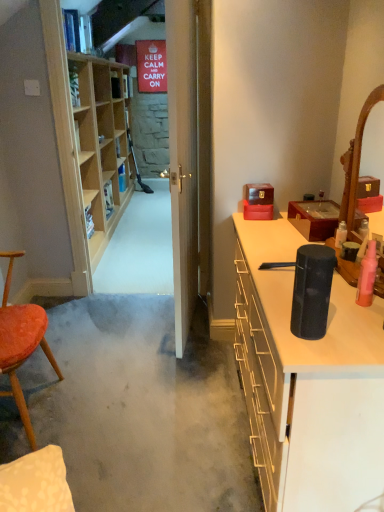
The image size is (384, 512). Find the location of `free spot above black matte speaker at right, the second cabinetry positioned from the top (from a real-world perspective)`. free spot above black matte speaker at right, the second cabinetry positioned from the top (from a real-world perspective) is located at coordinates (292, 262).